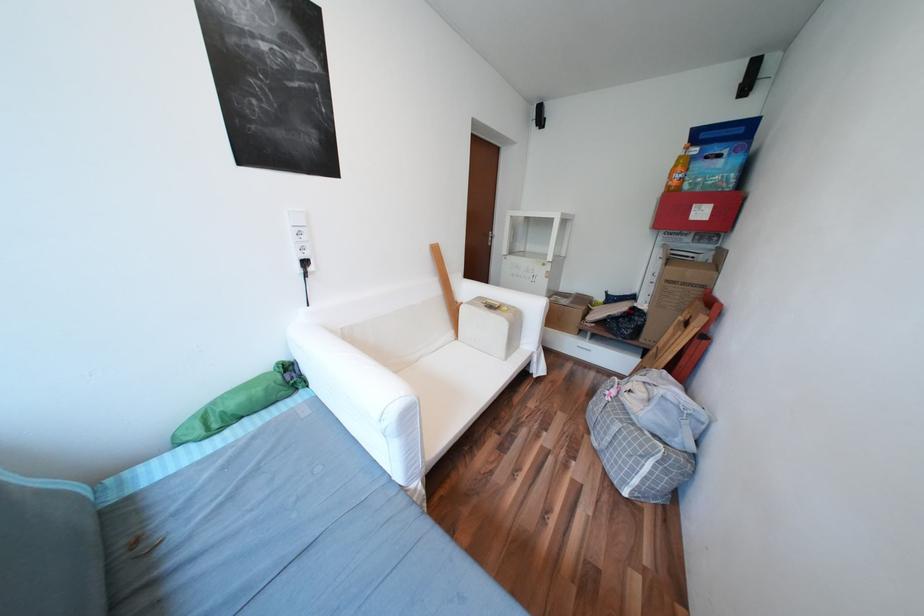
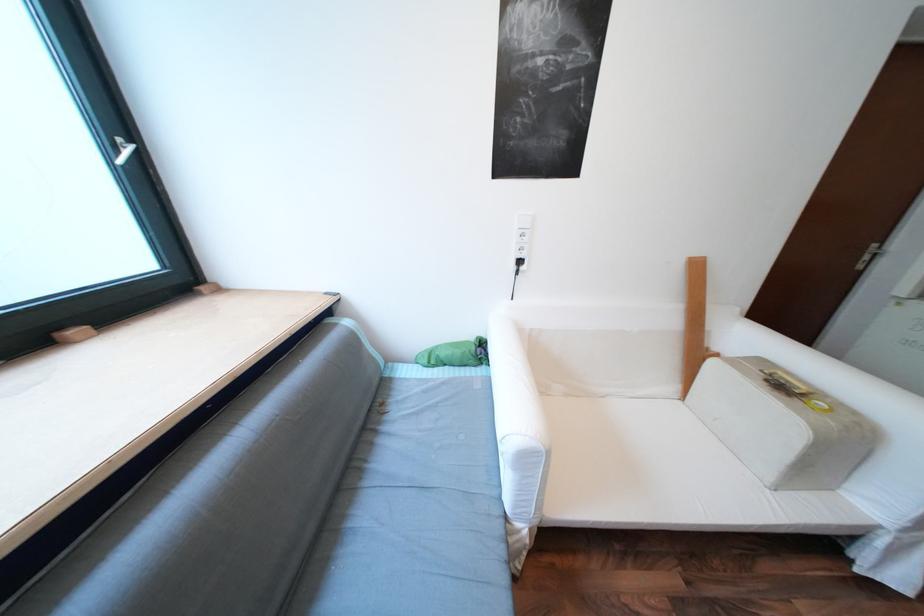
Question: The camera is either moving clockwise (left) or counter-clockwise (right) around the object. The first image is from the beginning of the video and the second image is from the end. Is the camera moving left or right when shooting the video?

Choices:
 (A) Left
 (B) Right

Answer: (B)